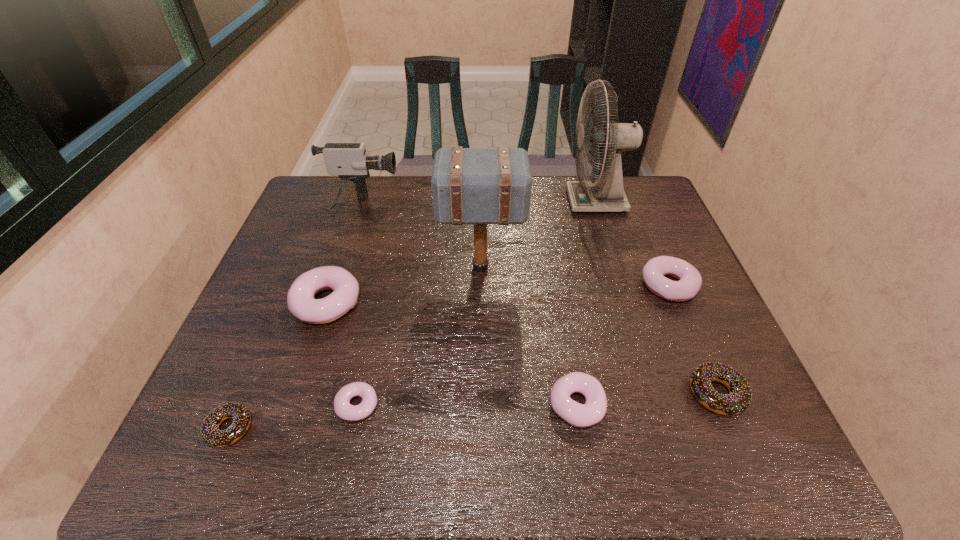
I want to click on camcorder that is positioned at the left edge, so click(349, 161).

This screenshot has width=960, height=540. What are the coordinates of `fan that is positioned at the right edge` in the screenshot? It's located at (607, 194).

You are a GUI agent. You are given a task and a screenshot of the screen. Output one action in this format:
    pyautogui.click(x=<x>, y=<y>)
    Task: Click on the object located at the far left corner
    This screenshot has width=960, height=540.
    Given the screenshot: What is the action you would take?
    pyautogui.click(x=349, y=161)

Locate an element on the screen. The height and width of the screenshot is (540, 960). object that is at the near left corner is located at coordinates (210, 432).

The image size is (960, 540). I want to click on object positioned at the far right corner, so click(607, 194).

In the image, there is a desktop. At what (x,y) coordinates should I click in order to perform the action: click on vacant space at the far edge. Please return your answer as a coordinate pair (x, y). The height and width of the screenshot is (540, 960). Looking at the image, I should click on (372, 195).

You are a GUI agent. You are given a task and a screenshot of the screen. Output one action in this format:
    pyautogui.click(x=<x>, y=<y>)
    Task: Click on the free spot at the left edge of the desktop
    
    Given the screenshot: What is the action you would take?
    pyautogui.click(x=227, y=381)

Image resolution: width=960 pixels, height=540 pixels. What are the coordinates of `vacant space at the near right corner` in the screenshot? It's located at tap(736, 453).

Image resolution: width=960 pixels, height=540 pixels. In order to click on vacant space that's between the sixth shortest object and the white camcorder in this screenshot , I will do `click(344, 254)`.

This screenshot has width=960, height=540. In order to click on empty location between the second purple doughnut from left to right and the fifth object from right to left in this screenshot , I will do `click(420, 336)`.